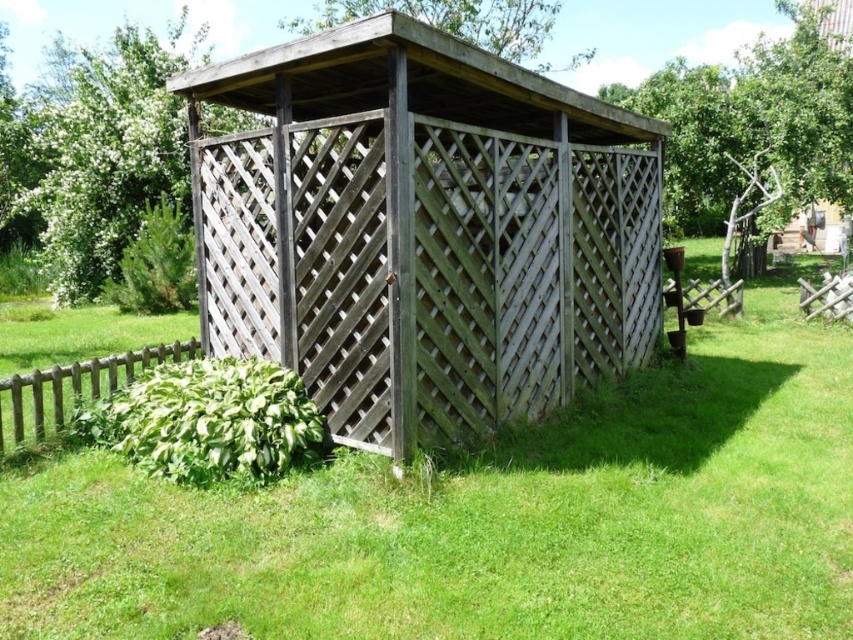
Between green grass at center and weathered wood gazebo at center, which one is positioned lower?

green grass at center is below.

Who is positioned more to the right, green grass at center or weathered wood gazebo at center?

Positioned to the right is green grass at center.

Identify the location of green grass at center. The width and height of the screenshot is (853, 640). pos(490,516).

Who is lower down, green grass at center or brown wooden fence at lower left?

brown wooden fence at lower left is below.

Which is more to the right, green grass at center or brown wooden fence at lower left?

green grass at center is more to the right.

This screenshot has height=640, width=853. What do you see at coordinates (490, 516) in the screenshot? I see `green grass at center` at bounding box center [490, 516].

Where is `green grass at center`? This screenshot has width=853, height=640. green grass at center is located at coordinates (490, 516).

Who is shorter, weathered wood gazebo at center or brown wooden fence at lower left?

With less height is brown wooden fence at lower left.

Is weathered wood gazebo at center shorter than brown wooden fence at lower left?

Incorrect, weathered wood gazebo at center's height does not fall short of brown wooden fence at lower left's.

Find the location of a particular element. This screenshot has height=640, width=853. weathered wood gazebo at center is located at coordinates (422, 230).

This screenshot has height=640, width=853. I want to click on weathered wood gazebo at center, so click(x=422, y=230).